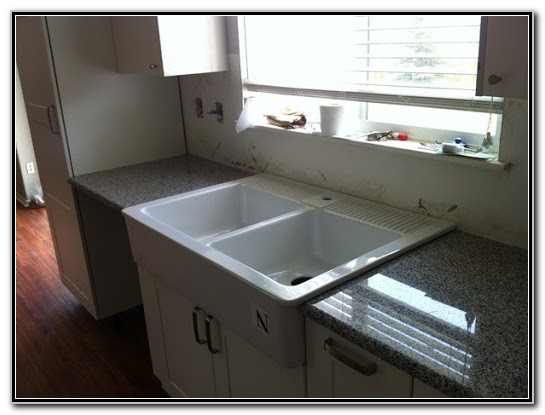
The image size is (545, 415). I want to click on white wall, so click(x=473, y=183).